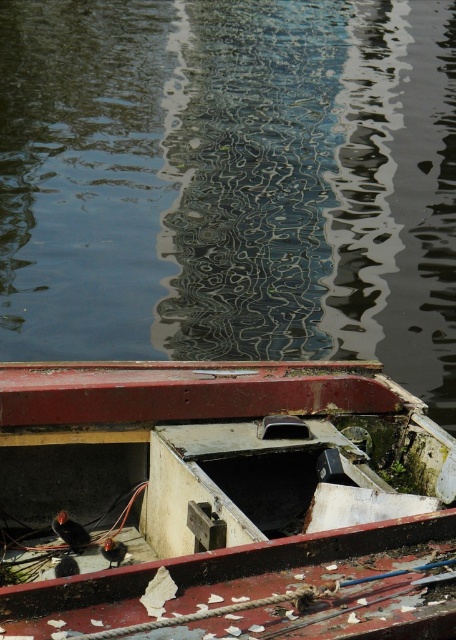
You are standing on the shore of the lake and see the partially submerged boat with its red hull. There is a point at coordinates (231, 182). What is the nature of the surface at this point?

The point at coordinates (231, 182) corresponds to smooth water at center.